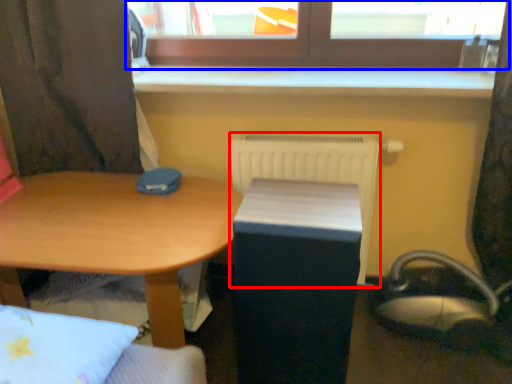
Question: Which point is further to the camera, radiator (highlighted by a red box) or window (highlighted by a blue box)?

Choices:
 (A) radiator
 (B) window

Answer: (A)